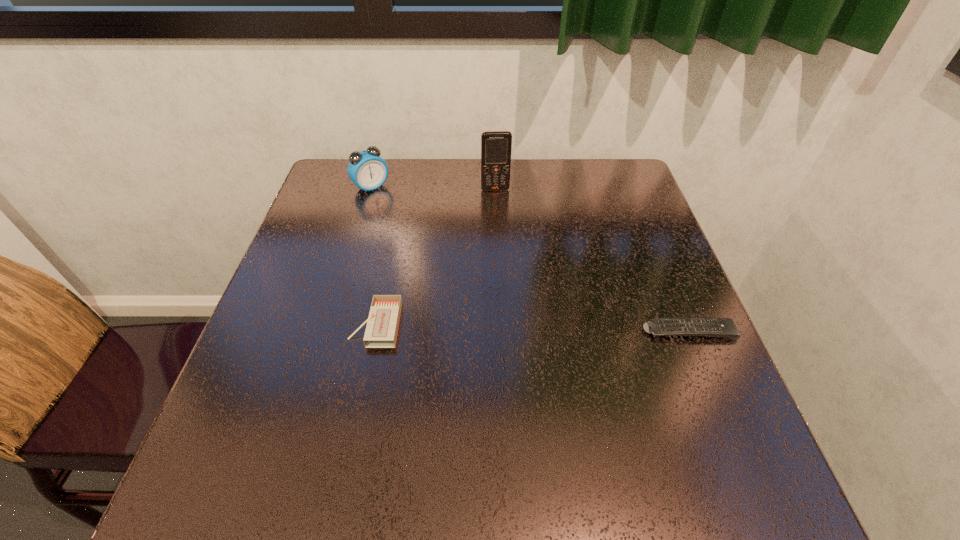
Identify the location of free point that satisfies the following two spatial constraints: 1. on the front side of the second tallest object; 2. on the striking surface of the matchbox. (330, 324).